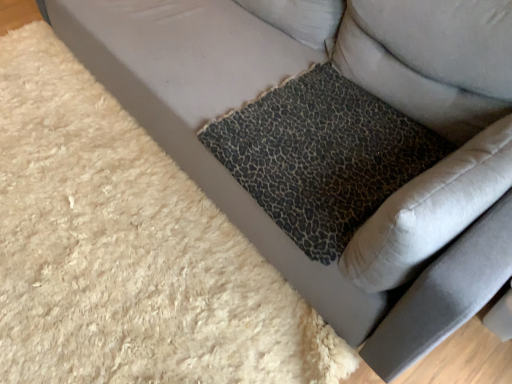
Question: Is the position of leopard print fabric pillow at upper right less distant than that of leopard print cushion at lower right?

Choices:
 (A) no
 (B) yes

Answer: (A)

Question: Considering the relative positions of leopard print fabric pillow at upper right and leopard print cushion at lower right in the image provided, is leopard print fabric pillow at upper right behind leopard print cushion at lower right?

Choices:
 (A) no
 (B) yes

Answer: (B)

Question: From the image's perspective, does leopard print fabric pillow at upper right appear lower than leopard print cushion at lower right?

Choices:
 (A) no
 (B) yes

Answer: (A)

Question: Is leopard print fabric pillow at upper right taller than leopard print cushion at lower right?

Choices:
 (A) no
 (B) yes

Answer: (B)

Question: Are leopard print fabric pillow at upper right and leopard print cushion at lower right located far from each other?

Choices:
 (A) no
 (B) yes

Answer: (A)

Question: Is point (373, 49) closer or farther from the camera than point (433, 173)?

Choices:
 (A) closer
 (B) farther

Answer: (B)

Question: From the image's perspective, is leopard print fabric pillow at upper right above or below leopard print cushion at lower right?

Choices:
 (A) below
 (B) above

Answer: (B)

Question: From a real-world perspective, is leopard print fabric pillow at upper right positioned above or below leopard print cushion at lower right?

Choices:
 (A) below
 (B) above

Answer: (B)

Question: Do you think leopard print fabric pillow at upper right is within leopard print cushion at lower right, or outside of it?

Choices:
 (A) outside
 (B) inside

Answer: (A)

Question: Considering the positions of leopard print fabric cushion at center and leopard print fabric pillow at upper right in the image, is leopard print fabric cushion at center wider or thinner than leopard print fabric pillow at upper right?

Choices:
 (A) wide
 (B) thin

Answer: (A)

Question: Based on their sizes in the image, would you say leopard print fabric cushion at center is bigger or smaller than leopard print fabric pillow at upper right?

Choices:
 (A) small
 (B) big

Answer: (A)

Question: Is leopard print fabric cushion at center situated inside leopard print fabric pillow at upper right or outside?

Choices:
 (A) outside
 (B) inside

Answer: (A)

Question: Considering their positions, is leopard print fabric cushion at center located in front of or behind leopard print fabric pillow at upper right?

Choices:
 (A) front
 (B) behind

Answer: (B)

Question: Visually, is leopard print cushion at lower right positioned to the left or to the right of leopard print fabric pillow at upper right?

Choices:
 (A) right
 (B) left

Answer: (B)

Question: Is leopard print cushion at lower right inside the boundaries of leopard print fabric pillow at upper right, or outside?

Choices:
 (A) outside
 (B) inside

Answer: (A)